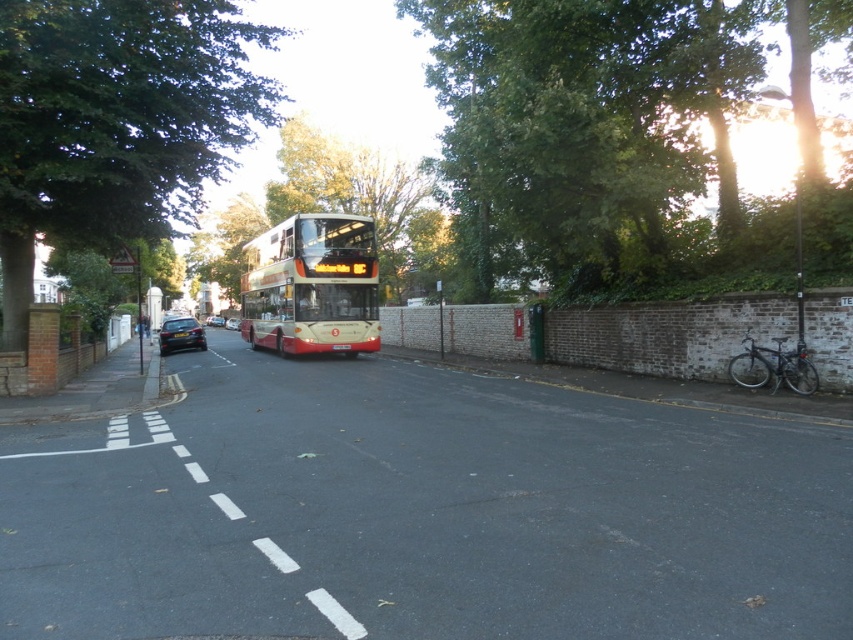
Question: From the image, what is the correct spatial relationship of white plastic license plate at center in relation to black plastic license plate at center?

Choices:
 (A) right
 (B) left

Answer: (A)

Question: Which point is closer to the camera?

Choices:
 (A) (312, 352)
 (B) (537, 13)
 (C) (94, 125)

Answer: (C)

Question: Does shiny silver car at center appear over shiny black sedan at center?

Choices:
 (A) yes
 (B) no

Answer: (B)

Question: Which of the following is the closest to the observer?

Choices:
 (A) shiny silver car at center
 (B) green leafy tree at upper left

Answer: (B)

Question: Which is nearer to the green leafy tree at upper left?

Choices:
 (A) green leafy tree at upper right
 (B) red polished double-decker bus at center

Answer: (A)

Question: Is shiny black car at left behind white plastic license plate at center?

Choices:
 (A) yes
 (B) no

Answer: (A)